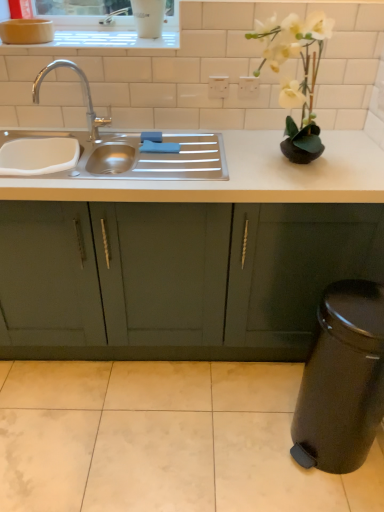
Where is `free point behind white matte vase at upper right`? The image size is (384, 512). free point behind white matte vase at upper right is located at coordinates coord(263,143).